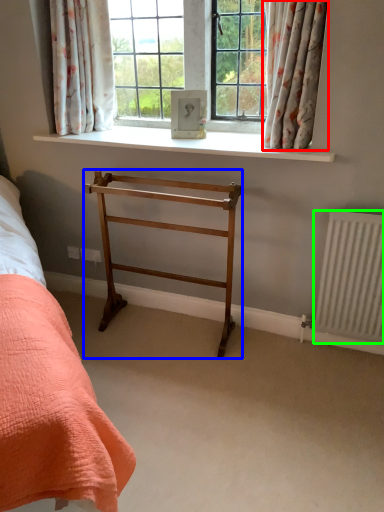
Question: Based on their relative distances, which object is farther from curtain (highlighted by a red box)? Choose from furniture (highlighted by a blue box) and radiator (highlighted by a green box).

Choices:
 (A) furniture
 (B) radiator

Answer: (B)